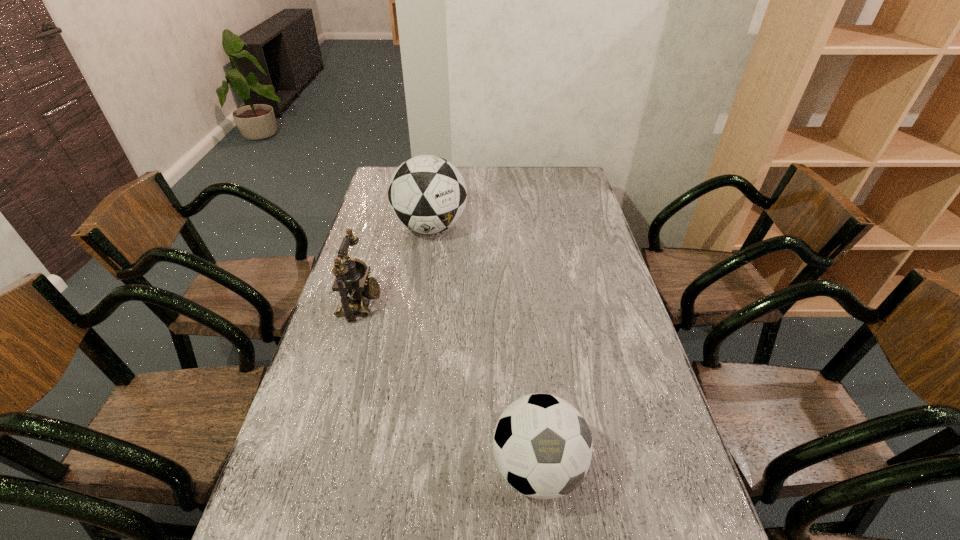
This screenshot has height=540, width=960. In order to click on vacant space at the right edge of the desktop in this screenshot , I will do `click(591, 222)`.

This screenshot has width=960, height=540. Find the location of `unoccupied position between the second nearest object and the left soccer ball`. unoccupied position between the second nearest object and the left soccer ball is located at coordinates (396, 266).

Identify the location of unoccupied position between the telephone and the shorter soccer ball. The height and width of the screenshot is (540, 960). (449, 386).

Where is `free point between the nearest object and the telephone`? This screenshot has height=540, width=960. free point between the nearest object and the telephone is located at coordinates (449, 386).

Identify the location of vacant space in between the nearer soccer ball and the second farthest object. (449, 386).

You are a GUI agent. You are given a task and a screenshot of the screen. Output one action in this format:
    pyautogui.click(x=<x>, y=<y>)
    Task: Click on the vacant area that lies between the left soccer ball and the nearer soccer ball
    Image resolution: width=960 pixels, height=540 pixels.
    Given the screenshot: What is the action you would take?
    pyautogui.click(x=484, y=348)

Select which object is the second closest to the shorter soccer ball. Please provide its 2D coordinates. Your answer should be formatted as a tuple, i.e. [(x, y)], where the tuple contains the x and y coordinates of a point satisfying the conditions above.

[(427, 194)]

Locate which object is the second closest to the tallest object. Please provide its 2D coordinates. Your answer should be formatted as a tuple, i.e. [(x, y)], where the tuple contains the x and y coordinates of a point satisfying the conditions above.

[(542, 445)]